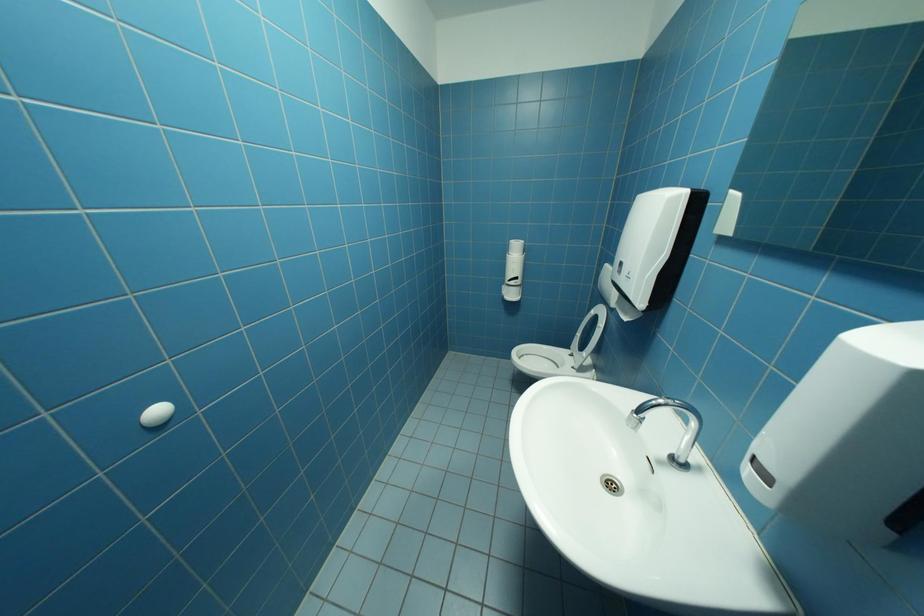
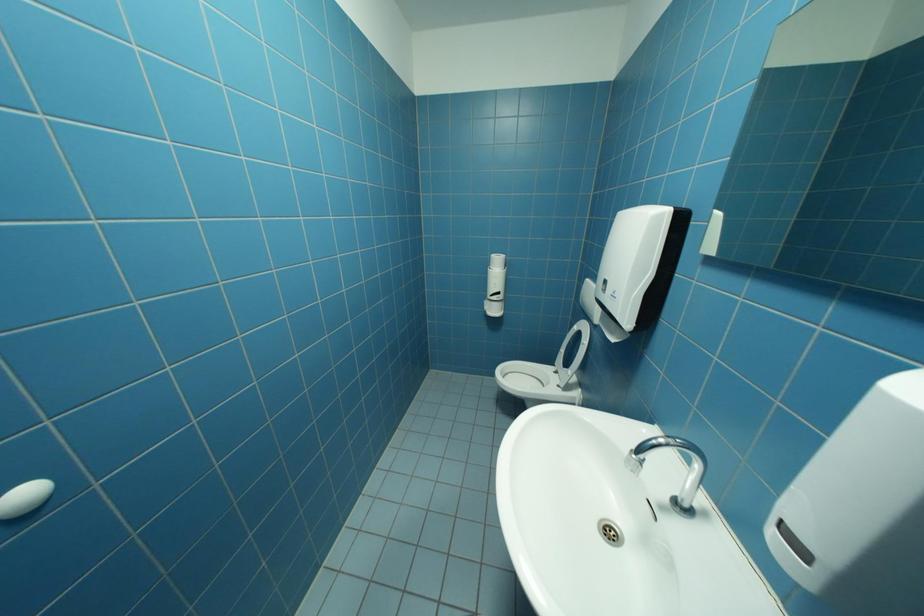
Question: The camera is either moving clockwise (left) or counter-clockwise (right) around the object. The first image is from the beginning of the video and the second image is from the end. Is the camera moving left or right when shooting the video?

Choices:
 (A) Left
 (B) Right

Answer: (A)